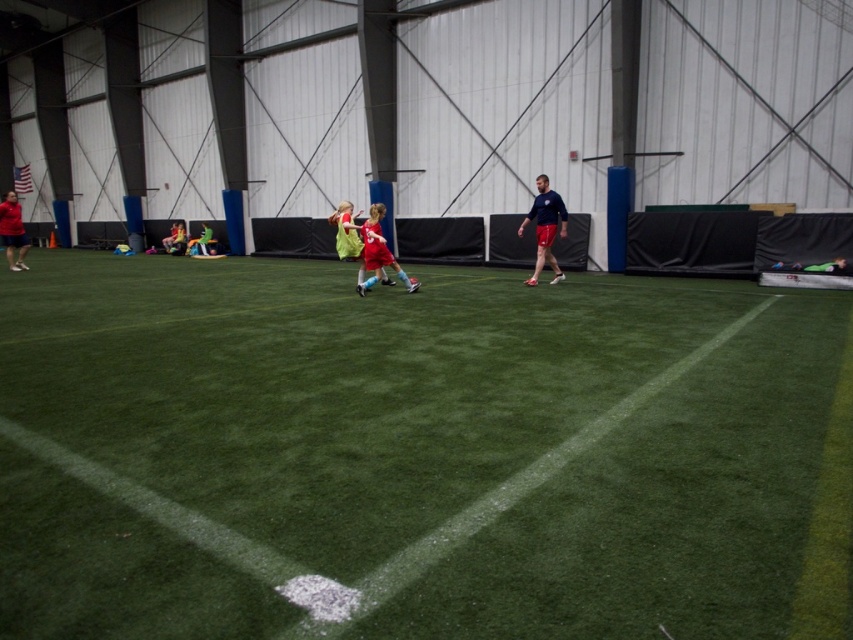
Does shiny red shorts at center appear on the left side of matte red shorts at left?

Incorrect, shiny red shorts at center is not on the left side of matte red shorts at left.

Who is more forward, (384, 250) or (7, 198)?

Point (384, 250)

Between point (376, 243) and point (13, 243), which one is positioned behind?

The point (13, 243) is behind.

Where is `shiny red shorts at center`? This screenshot has width=853, height=640. shiny red shorts at center is located at coordinates (379, 252).

In the scene shown: Which is below, green artificial turf at center or shiny red shorts at center?

green artificial turf at center is below.

Who is positioned more to the left, green artificial turf at center or shiny red shorts at center?

From the viewer's perspective, shiny red shorts at center appears more on the left side.

This screenshot has width=853, height=640. In order to click on green artificial turf at center in this screenshot , I will do `click(413, 452)`.

Can you confirm if dark blue jersey at center is bigger than green fabric jacket at center?

A: Indeed, dark blue jersey at center has a larger size compared to green fabric jacket at center.

Does point (555, 214) lie in front of point (207, 248)?

Yes.

Locate an element on the screen. dark blue jersey at center is located at coordinates (544, 227).